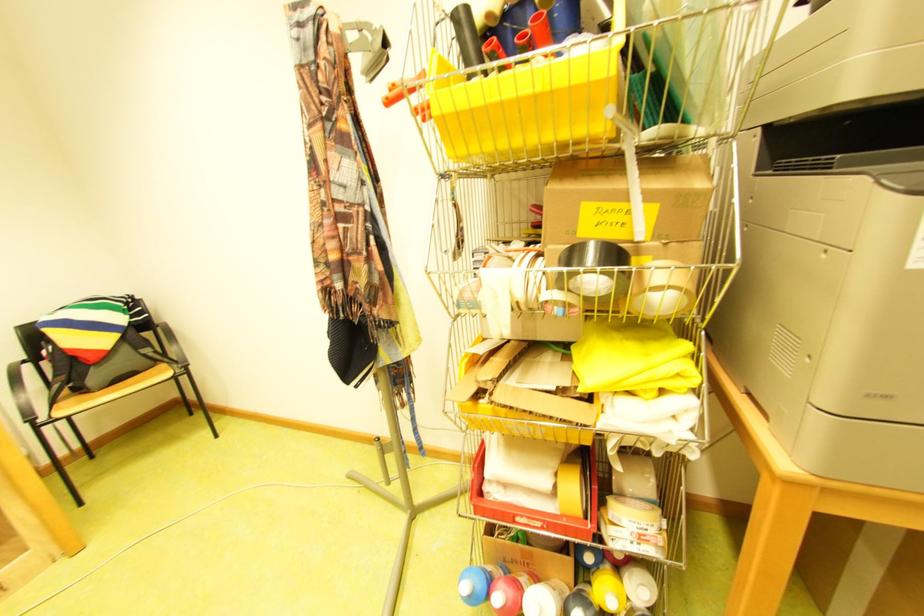
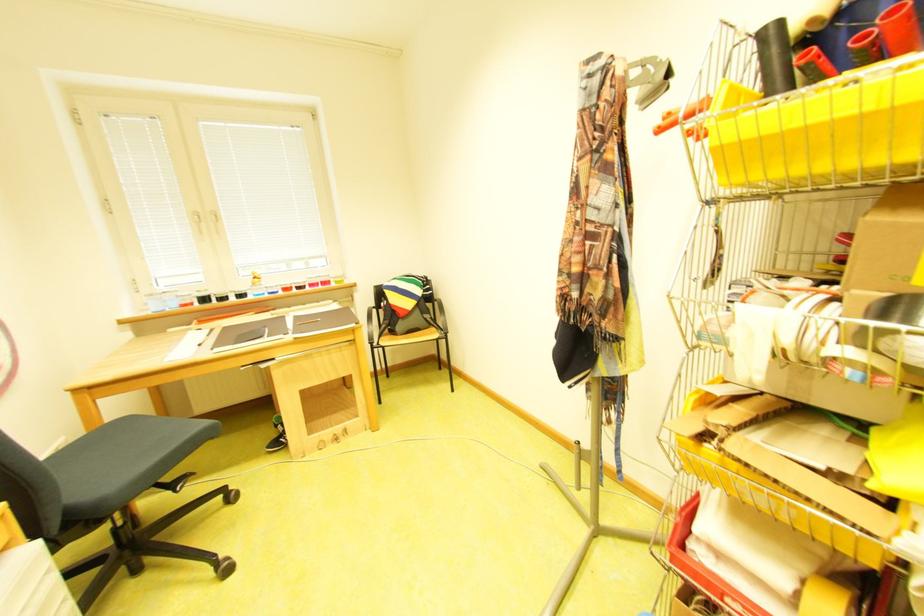
Find the pixel in the second image that matches (407,86) in the first image.

(687, 111)